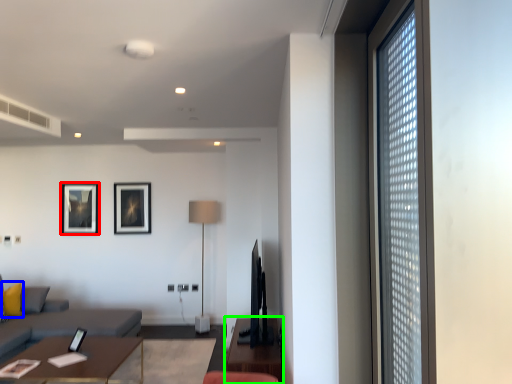
Question: Based on their relative distances, which object is farther from picture frame (highlighted by a red box)? Choose from pillow (highlighted by a blue box) and table (highlighted by a green box).

Choices:
 (A) pillow
 (B) table

Answer: (B)